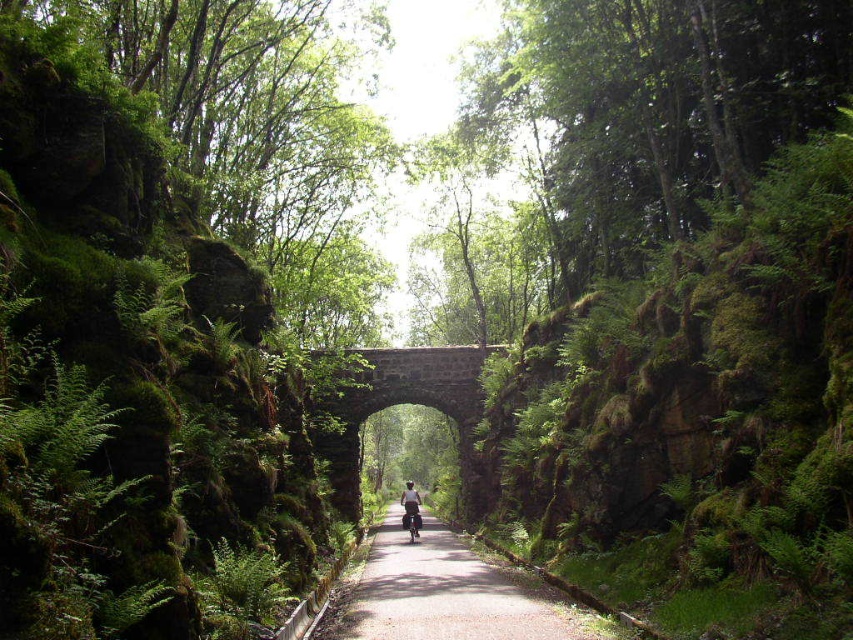
You are a hiker walking along the narrow path through the forest and want to reach the stone bridge. You notice two points marked on your map as point 1 at coordinates (x=368, y=625) and point 2 at coordinates (x=397, y=360). According to the map, which point is closer to the bridge?

Point 1 at coordinates (x=368, y=625) is in front of point 2 at coordinates (x=397, y=360), so it is closer to the bridge.

You are a hiker who wants to ride your metallic silver motorbike at center through the smooth asphalt path at center. The motorbike requires at least 20 meters of clear path to start moving. Can you start riding your motorbike?

The smooth asphalt path at center is 19.85 meters from metallic silver motorbike at center, which is less than the required 20 meters. Therefore, you cannot start riding your motorbike.

You are a hiker planning to ride your metallic silver motorbike at center through the narrow forest path. There is a stone archway at center above the path. Can you pass under the archway without hitting it?

The stone archway at center is located above the metallic silver motorbike at center, so the motorbike can pass under it as long as it stays on the path and does not exceed the height limit imposed by the archway.